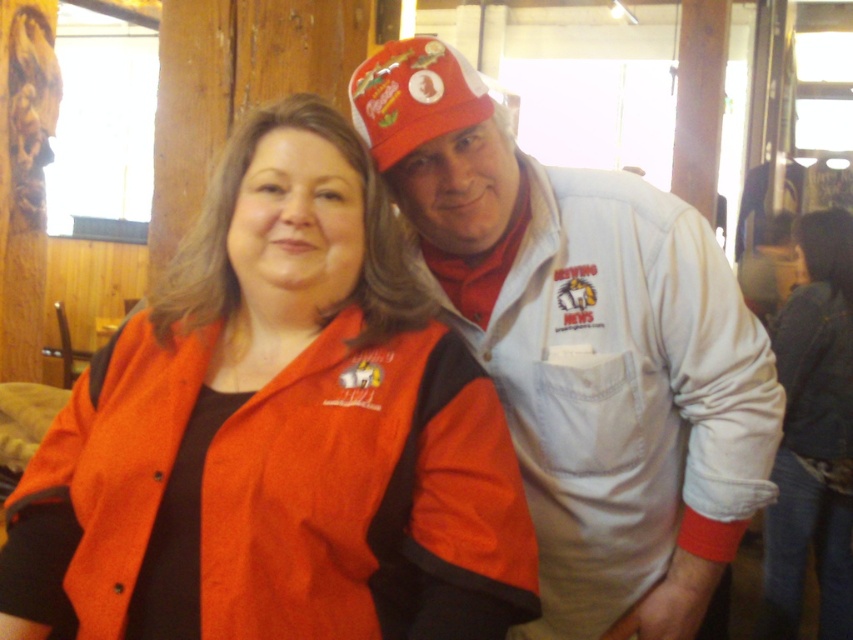
From the picture: You are a photographer trying to capture a clear photo of the matte red cap at upper center and the denim jacket at lower right. Since you want both items to appear equally prominent in the photo, which object should you zoom in on more?

The denim jacket at lower right is larger in size than the matte red cap at upper center, so you should zoom in more on the matte red cap at upper center to balance their prominence in the photo.